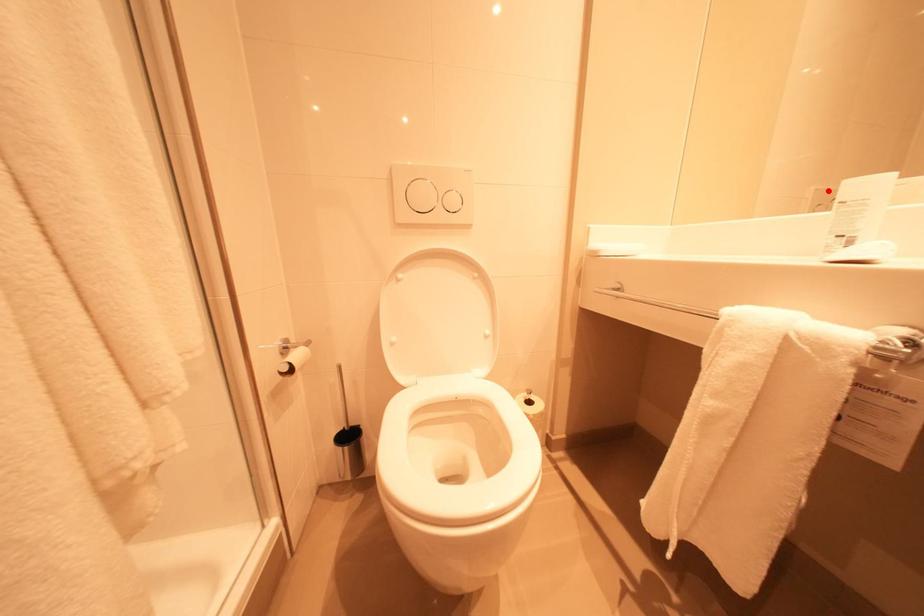
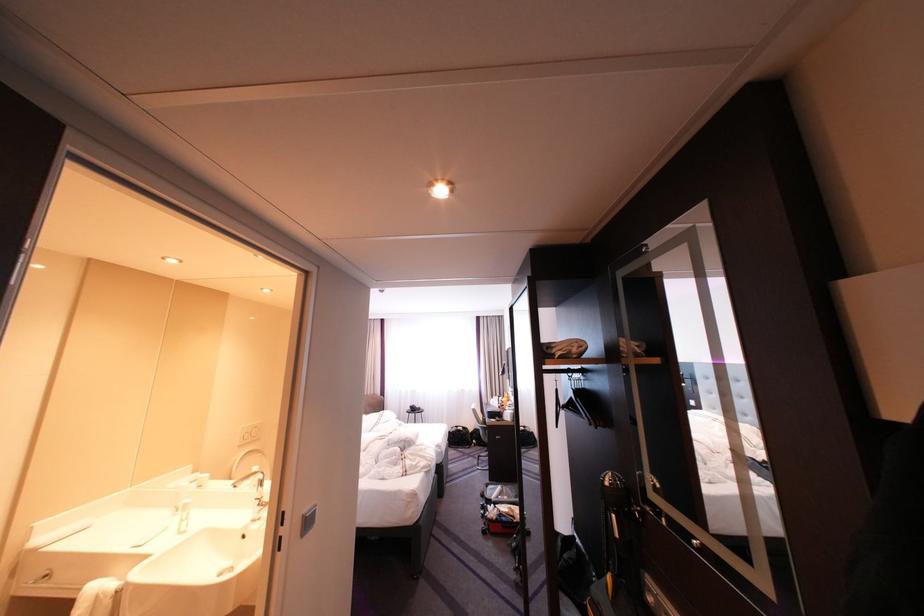
The point at the highlighted location is marked in the first image. Where is the corresponding point in the second image?

(254, 429)